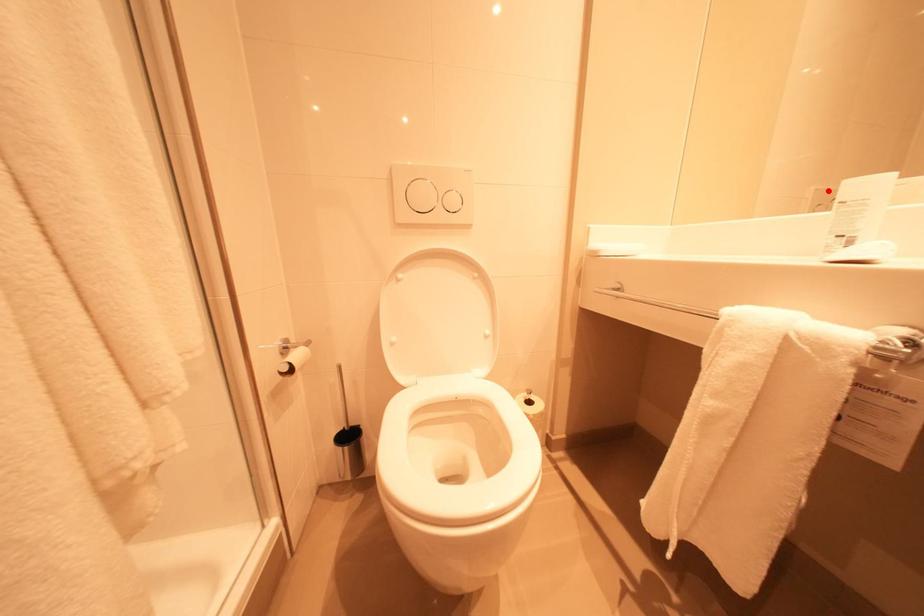
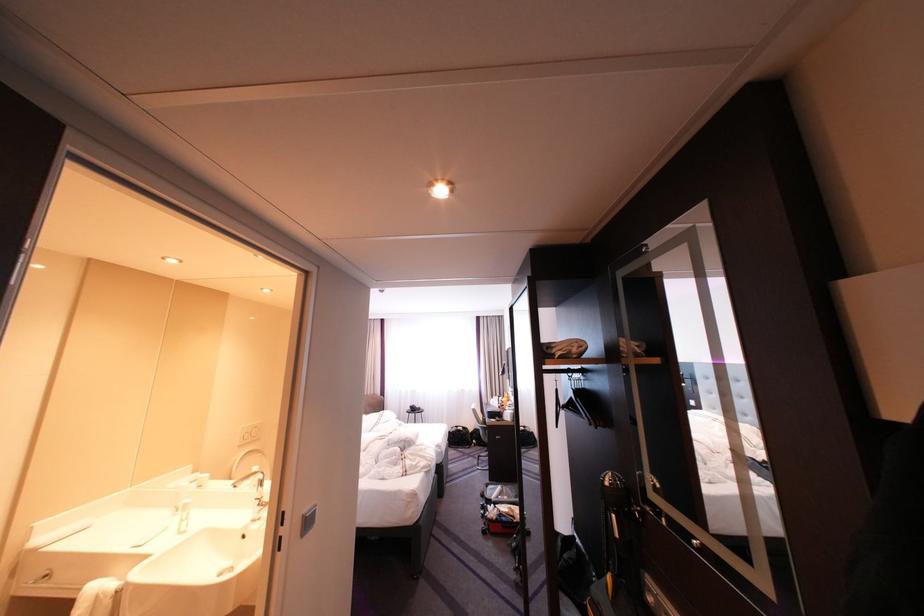
The point at the highlighted location is marked in the first image. Where is the corresponding point in the second image?

(254, 429)